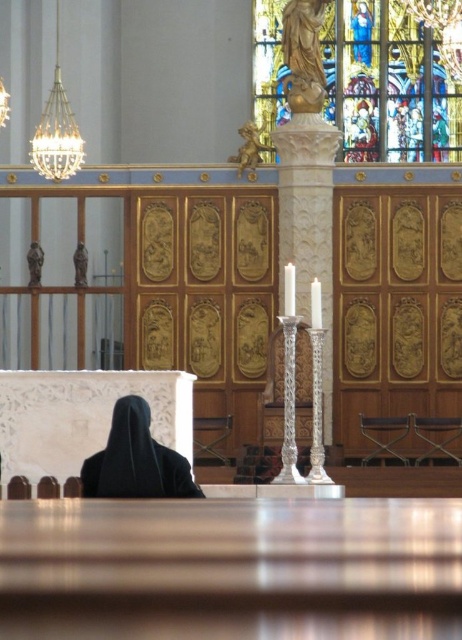
Question: Can you confirm if stained glass window at upper center is wider than gold polished statue at upper center?

Choices:
 (A) no
 (B) yes

Answer: (B)

Question: Can you confirm if black matte robe at lower left is positioned to the left of white porcelain candle at center?

Choices:
 (A) yes
 (B) no

Answer: (A)

Question: Can you confirm if white porcelain candle at center is positioned to the right of white glossy candle at center?

Choices:
 (A) no
 (B) yes

Answer: (A)

Question: Among these objects, which one is farthest from the camera?

Choices:
 (A) gold polished statue at upper center
 (B) black matte robe at lower left
 (C) stained glass window at upper center

Answer: (C)

Question: Which of the following is the farthest from the observer?

Choices:
 (A) (295, 296)
 (B) (303, 99)
 (C) (317, 320)

Answer: (B)

Question: Which of the following is the farthest from the observer?

Choices:
 (A) (150, 419)
 (B) (308, 77)
 (C) (372, 100)

Answer: (C)